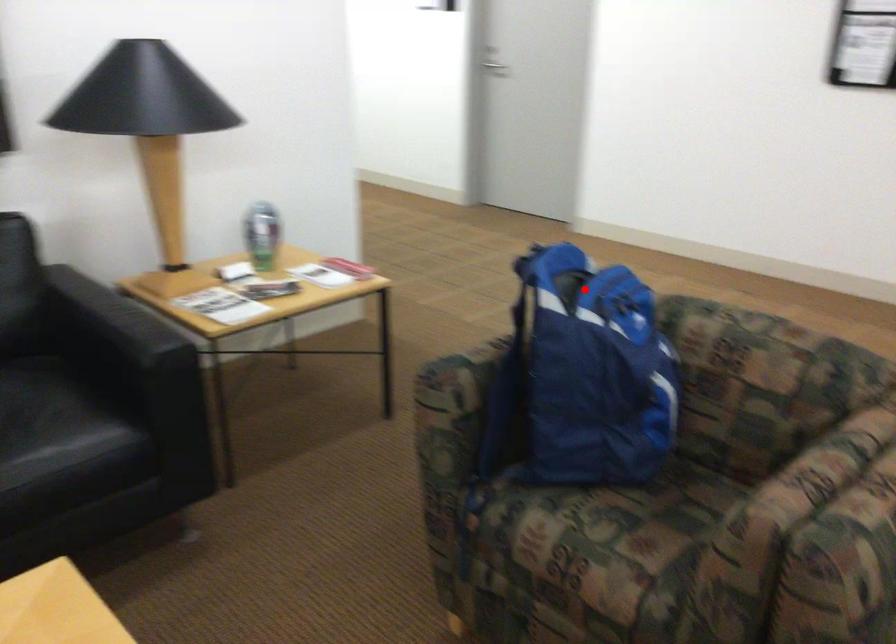
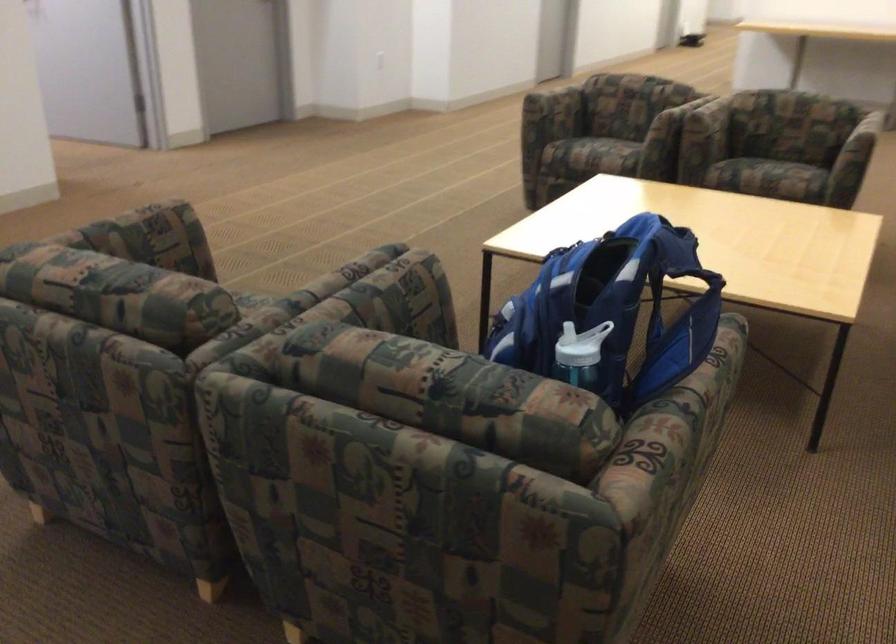
Question: I am providing you with two images of the same scene from different viewpoints. Image1 has a red point marked. In image2, the corresponding 3D location appears at what relative position? Reply with the corresponding letter.

Choices:
 (A) Closer
 (B) Farther

Answer: (A)